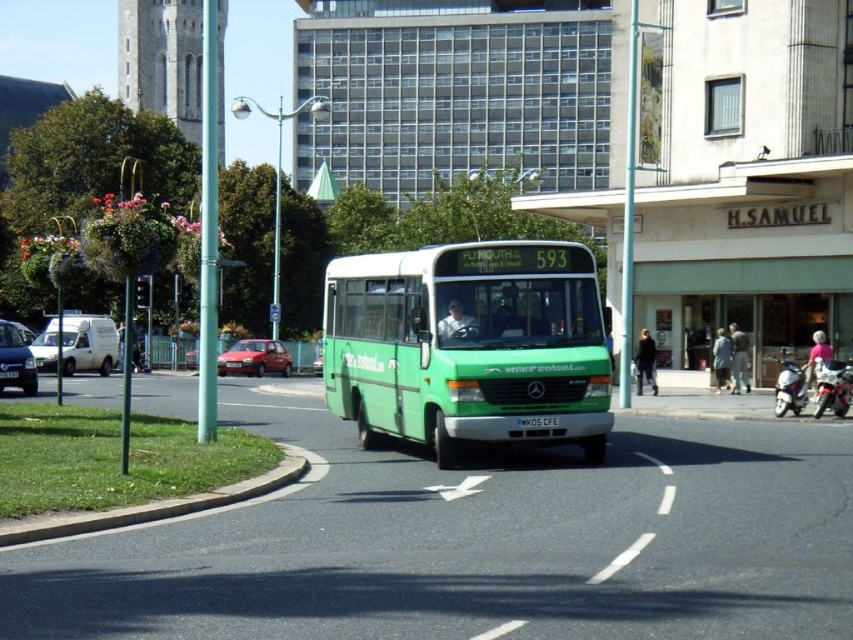
Who is more distant from viewer, (10, 376) or (552, 419)?

The point (10, 376) is behind.

Based on the photo, who is more forward, (4, 352) or (532, 420)?

Positioned in front is point (532, 420).

I want to click on metallic silver car at left, so click(x=15, y=358).

In the scene shown: Is green matte bus at center above white plastic license plate at center?

No, green matte bus at center is not above white plastic license plate at center.

Between green matte bus at center and white plastic license plate at center, which one is positioned higher?

white plastic license plate at center

Is point (453, 268) positioned in front of point (527, 417)?

No, (453, 268) is behind (527, 417).

This screenshot has width=853, height=640. Identify the location of green matte bus at center. (468, 344).

Can you confirm if green matte bus at center is positioned below metallic silver car at left?

Yes, green matte bus at center is below metallic silver car at left.

Between point (436, 388) and point (0, 384), which one is positioned behind?

Point (0, 384)

Identify the location of green matte bus at center. This screenshot has width=853, height=640. 468,344.